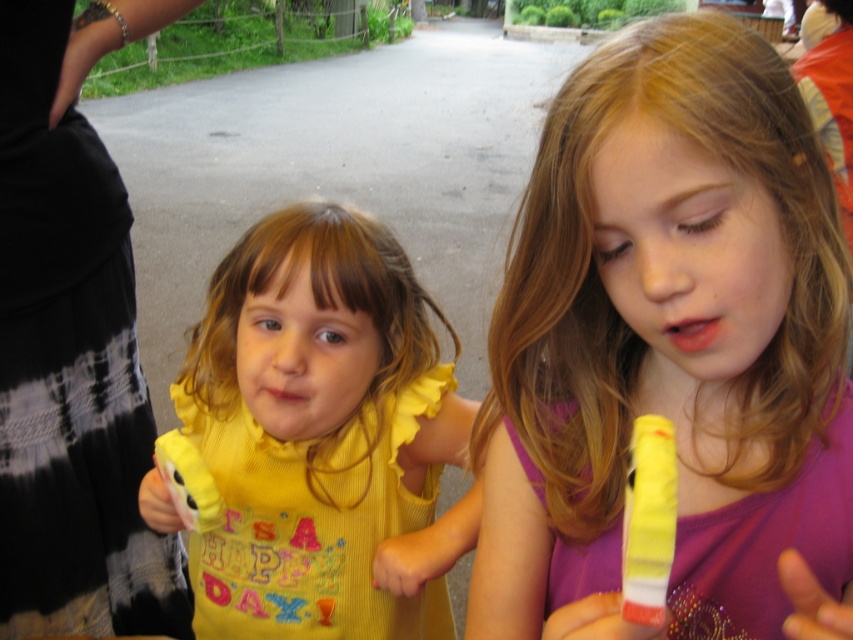
Consider the image. Who is higher up, yellow fabric dress at center or yellow plastic toy at right?

yellow plastic toy at right is higher up.

Between yellow fabric dress at center and yellow plastic toy at right, which one has more height?

yellow fabric dress at center is taller.

Is point (453, 440) more distant than point (662, 509)?

Yes, it is.

At what (x,y) coordinates should I click in order to perform the action: click on yellow fabric dress at center. Please return your answer as a coordinate pair (x, y). The height and width of the screenshot is (640, 853). Looking at the image, I should click on (318, 435).

Can you confirm if purple shiny dress at center is positioned above yellow plastic toy at right?

Correct, purple shiny dress at center is located above yellow plastic toy at right.

Is purple shiny dress at center positioned behind yellow plastic toy at right?

No, purple shiny dress at center is in front of yellow plastic toy at right.

Find the location of a particular element. purple shiny dress at center is located at coordinates (669, 346).

Locate an element on the screen. purple shiny dress at center is located at coordinates (669, 346).

From the picture: Is purple shiny dress at center shorter than yellow fabric toy at left?

No, purple shiny dress at center is not shorter than yellow fabric toy at left.

Which is in front, point (706, 442) or point (204, 525)?

Positioned in front is point (706, 442).

You are a GUI agent. You are given a task and a screenshot of the screen. Output one action in this format:
    pyautogui.click(x=<x>, y=<y>)
    Task: Click on the purple shiny dress at center
    
    Given the screenshot: What is the action you would take?
    pyautogui.click(x=669, y=346)